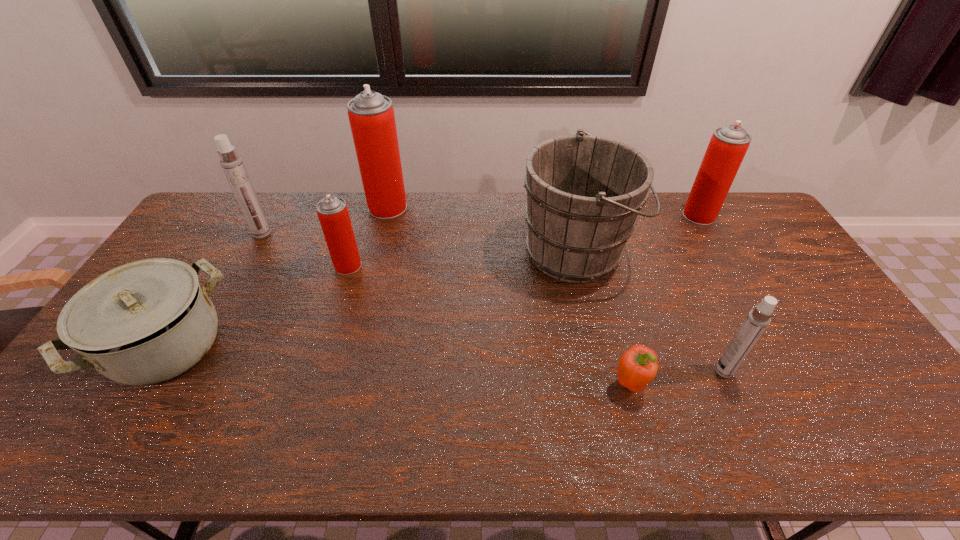
Locate an element on the screen. Image resolution: width=960 pixels, height=540 pixels. free space between the second nearest aerosol can and the seventh tallest object is located at coordinates (257, 306).

The height and width of the screenshot is (540, 960). In order to click on vacant area that lies between the leftmost aerosol can and the nearest aerosol can in this screenshot , I will do `click(492, 302)`.

Locate an element on the screen. free space between the seventh object from left to right and the pepper is located at coordinates (677, 377).

The width and height of the screenshot is (960, 540). I want to click on free space between the nearer white aerosol can and the orange pepper, so click(x=677, y=377).

You are a GUI agent. You are given a task and a screenshot of the screen. Output one action in this format:
    pyautogui.click(x=<x>, y=<y>)
    Task: Click on the unoccupied area between the orange pepper and the saucepan
    The width and height of the screenshot is (960, 540).
    Given the screenshot: What is the action you would take?
    pyautogui.click(x=398, y=365)

You are a GUI agent. You are given a task and a screenshot of the screen. Output one action in this format:
    pyautogui.click(x=<x>, y=<y>)
    Task: Click on the free spot between the bigger white aerosol can and the bucket
    This screenshot has height=540, width=960.
    Given the screenshot: What is the action you would take?
    pyautogui.click(x=420, y=242)

The height and width of the screenshot is (540, 960). Find the location of `free space between the saucepan and the pepper`. free space between the saucepan and the pepper is located at coordinates (398, 365).

Locate an element on the screen. The width and height of the screenshot is (960, 540). free space between the tallest object and the nearest red aerosol can is located at coordinates (368, 237).

Identify the location of vacant space that is in between the orange pepper and the second nearest aerosol can. (489, 325).

Identify the location of the third closest object relative to the tallest object. (584, 192).